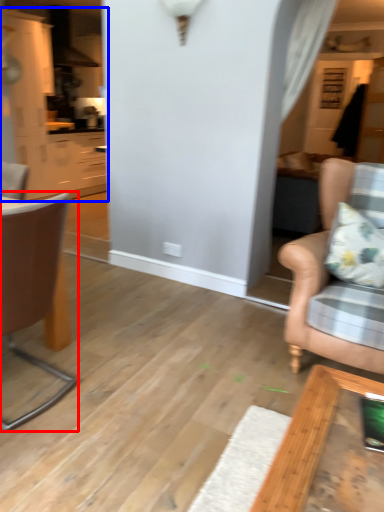
Question: Which of the following is the closest to the observer, chair (highlighted by a red box) or cabinetry (highlighted by a blue box)?

Choices:
 (A) chair
 (B) cabinetry

Answer: (A)